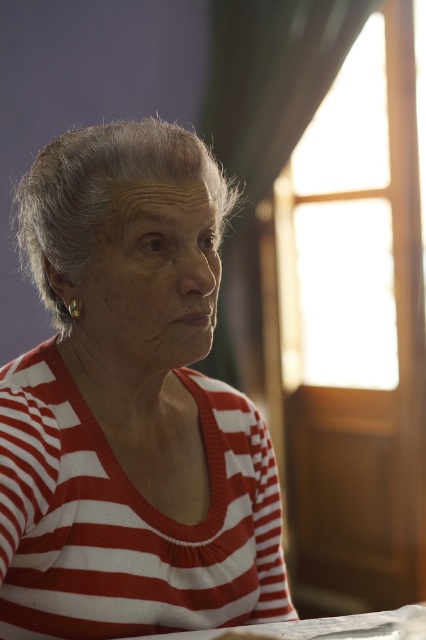
Question: Is red striped sweater at center thinner than white paper at lower center?

Choices:
 (A) no
 (B) yes

Answer: (A)

Question: Which object is farther from the camera taking this photo?

Choices:
 (A) white paper at lower center
 (B) red striped sweater at center

Answer: (B)

Question: Is red striped sweater at center closer to the viewer compared to white paper at lower center?

Choices:
 (A) yes
 (B) no

Answer: (B)

Question: Which point appears closest to the camera in this image?

Choices:
 (A) (9, 612)
 (B) (351, 621)

Answer: (A)

Question: Is red striped sweater at center to the right of white paper at lower center from the viewer's perspective?

Choices:
 (A) yes
 (B) no

Answer: (B)